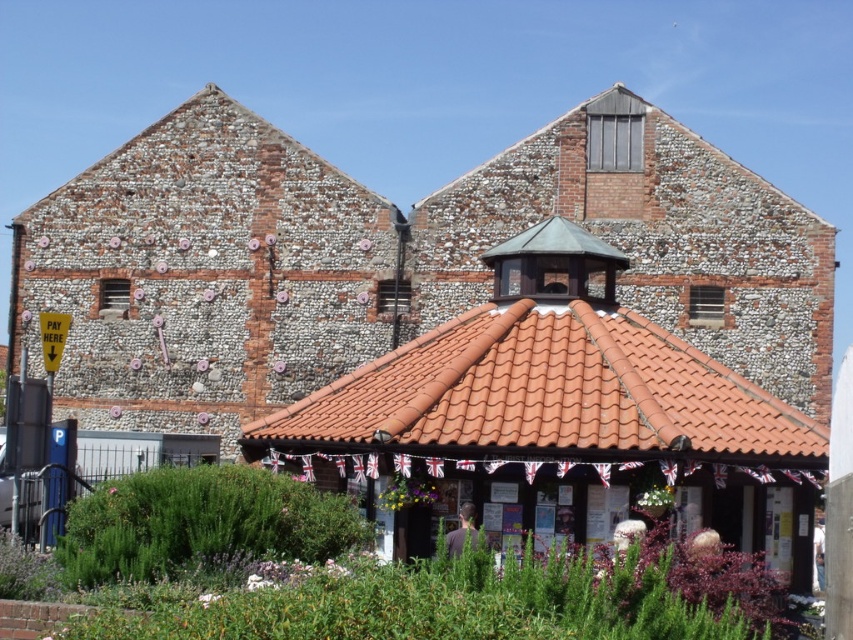
You are planning to place a large potted plant in the center of the brown tiled gazebo at center and the terracotta tiles at center. Which location has enough space to accommodate the plant?

The brown tiled gazebo at center might be wider than terracotta tiles at center, so it likely has enough space to accommodate the large potted plant.

You are standing in a park and see the brown tiled gazebo at center. If you want to reach it quickly, should you walk straight ahead or turn left? The historic building is behind the gazebo.

The brown tiled gazebo at center is 46.09 meters away from viewer. Since the historic building is behind the gazebo, you should walk straight ahead to reach the gazebo quickly.

You are planning to place a new bench in the garden. The bench requires a flat area at least 2 meters wide. The brown tiled gazebo at center and the terracotta tiles at center are in the way. Which object is closer to the left edge of the garden path?

The terracotta tiles at center are closer to the left edge of the garden path because the brown tiled gazebo at center is positioned on the right side of them.